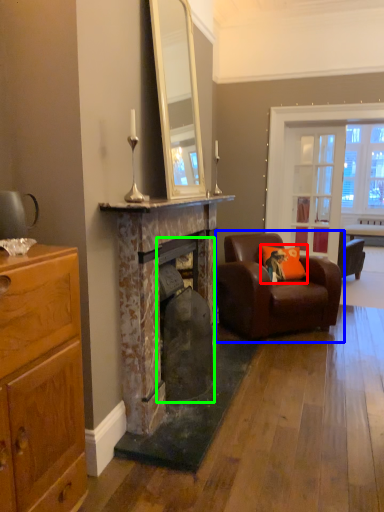
Question: Estimate the real-world distances between objects in this image. Which object is farther from pillow (highlighted by a red box), chair (highlighted by a blue box) or fireplace (highlighted by a green box)?

Choices:
 (A) chair
 (B) fireplace

Answer: (B)